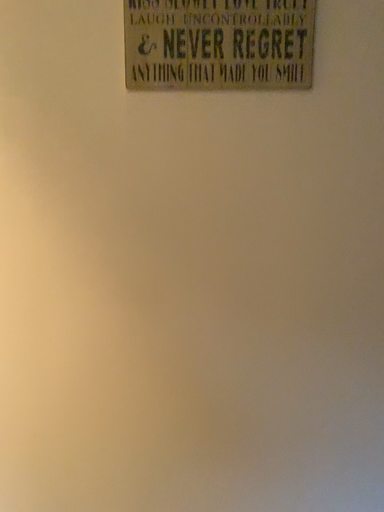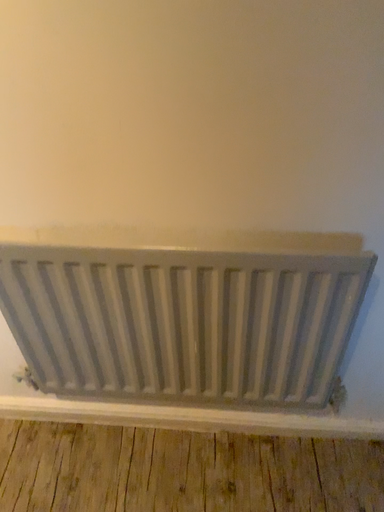
Question: How did the camera likely rotate when shooting the video?

Choices:
 (A) rotated upward
 (B) rotated downward

Answer: (B)